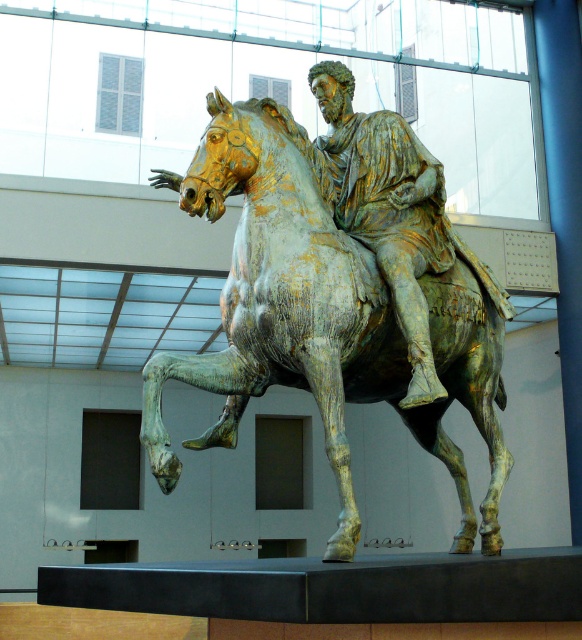
Question: Which point is farther from the camera taking this photo?

Choices:
 (A) (398, 252)
 (B) (399, 262)

Answer: (A)

Question: Can you confirm if gold patina bronze horse and rider at center is bigger than gold/gilded bronze rider at center?

Choices:
 (A) yes
 (B) no

Answer: (A)

Question: Which object appears closest to the camera in this image?

Choices:
 (A) gold patina bronze horse and rider at center
 (B) gold/gilded bronze rider at center

Answer: (A)

Question: Where is gold patina bronze horse and rider at center located in relation to gold/gilded bronze rider at center in the image?

Choices:
 (A) right
 (B) left

Answer: (B)

Question: Which point appears farthest from the camera in this image?

Choices:
 (A) (427, 179)
 (B) (285, 324)

Answer: (A)

Question: Is gold patina bronze horse and rider at center thinner than gold/gilded bronze rider at center?

Choices:
 (A) yes
 (B) no

Answer: (B)